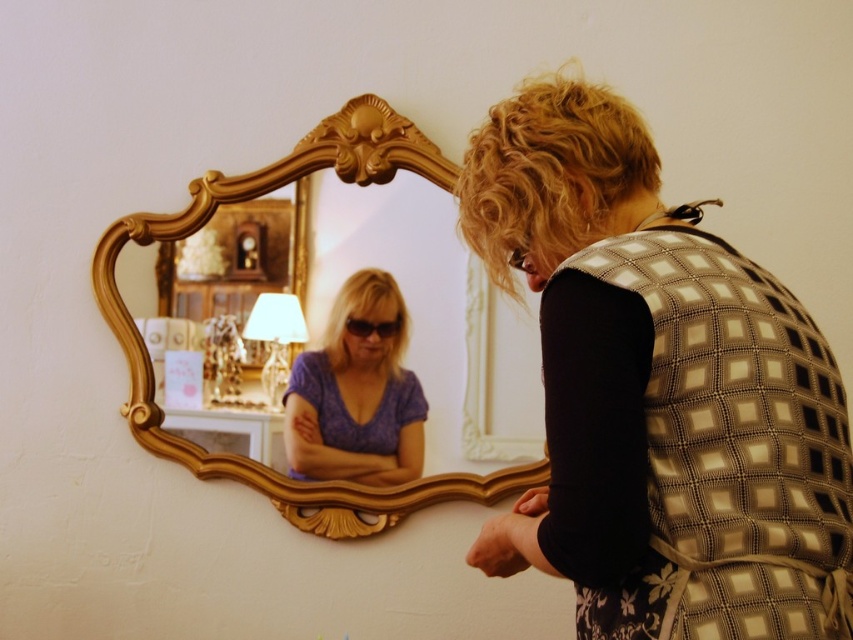
You are an interior designer analyzing the placement of items in the room. You notice a specific point at coordinates point (x=659, y=392). Based on the scene description, what object or feature is located at that point?

The point (x=659, y=392) is on the patterned fabric vest at center.

You are a tailor who needs to measure the distance between the patterned fabric vest at center and yourself to ensure proper alterations. According to the image, can you confirm if the vest is within a comfortable working distance of 40 inches or closer?

The distance between the patterned fabric vest at center and the viewer is 37.37 inches, which is within the comfortable working distance of 40 inches or closer.

You are a photographer who wants to take a closeup shot of the patterned fabric vest at center. You have a camera that requires a minimum distance of 40 inches to focus properly. Based on the scene, can you focus on the vest with your current camera settings?

The patterned fabric vest at center and camera are 37.37 inches apart, which is less than the required 40 inches. Therefore, the camera cannot focus properly on the vest at this distance.